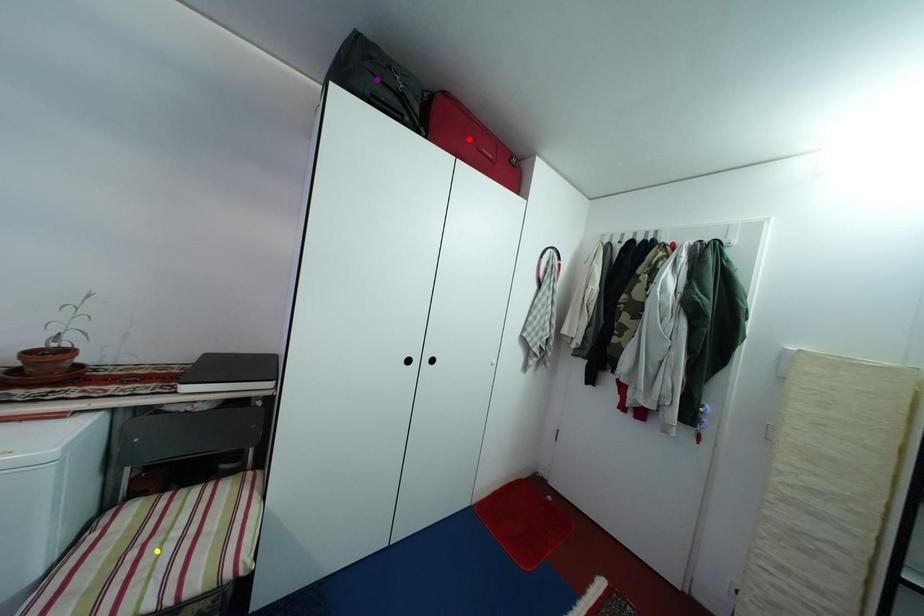
Order these from nearest to farthest:
A) purple point
B) yellow point
C) red point

yellow point
purple point
red point